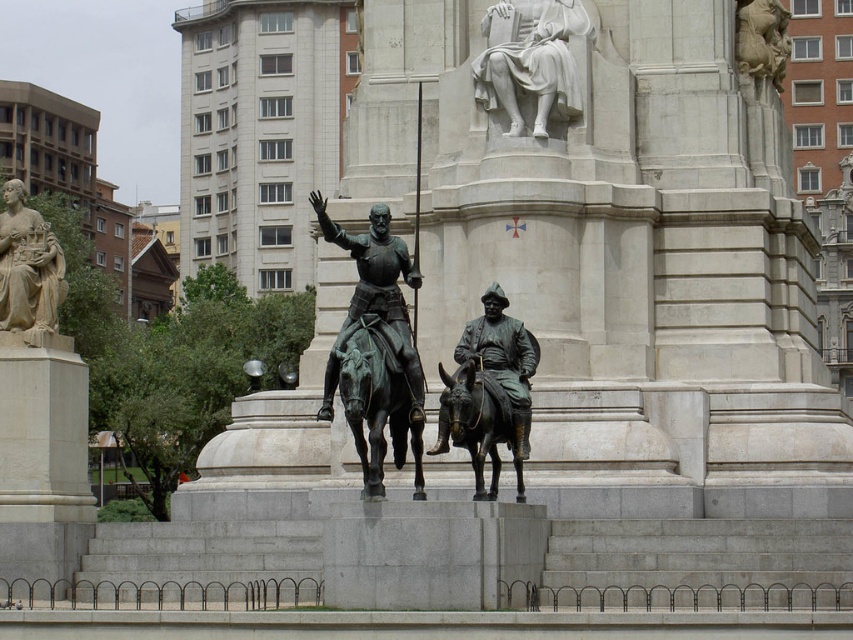
Does green patina statue at center appear on the left side of bronze/dark brown horse at center?

Yes, green patina statue at center is to the left of bronze/dark brown horse at center.

Is green patina statue at center thinner than bronze/dark brown horse at center?

No.

Between point (378, 280) and point (476, 381), which one is positioned behind?

Point (476, 381)

At what (x,y) coordinates should I click in order to perform the action: click on green patina statue at center. Please return your answer as a coordinate pair (x, y). This screenshot has height=640, width=853. Looking at the image, I should click on (374, 298).

Is bronze/dark brown horse at center wider than polished marble horse at upper right?

Indeed, bronze/dark brown horse at center has a greater width compared to polished marble horse at upper right.

Is point (489, 394) positioned in front of point (782, 36)?

That is True.

Between point (489, 449) and point (782, 10), which one is positioned in front?

Point (489, 449)

Find the location of a particular element. bronze/dark brown horse at center is located at coordinates (479, 422).

The image size is (853, 640). In order to click on bronze/golden horse at center in this screenshot , I will do `click(376, 406)`.

Based on the photo, can you confirm if bronze/golden horse at center is wider than polished bronze statue at left?

No, bronze/golden horse at center is not wider than polished bronze statue at left.

The height and width of the screenshot is (640, 853). Find the location of `bronze/golden horse at center`. bronze/golden horse at center is located at coordinates (376, 406).

The width and height of the screenshot is (853, 640). I want to click on bronze/golden horse at center, so click(x=376, y=406).